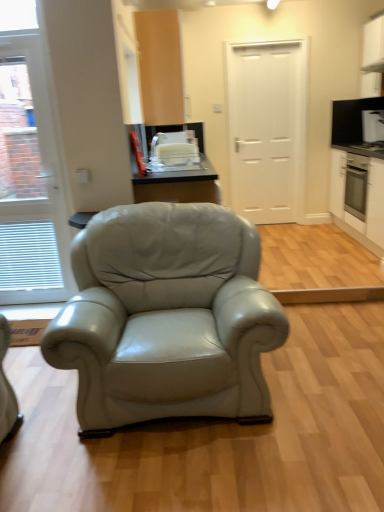
Find the location of a particular element. This screenshot has width=384, height=512. free space above white matte door at center, which is counted as the 1th door, starting from the back (from a real-world perspective) is located at coordinates (271, 44).